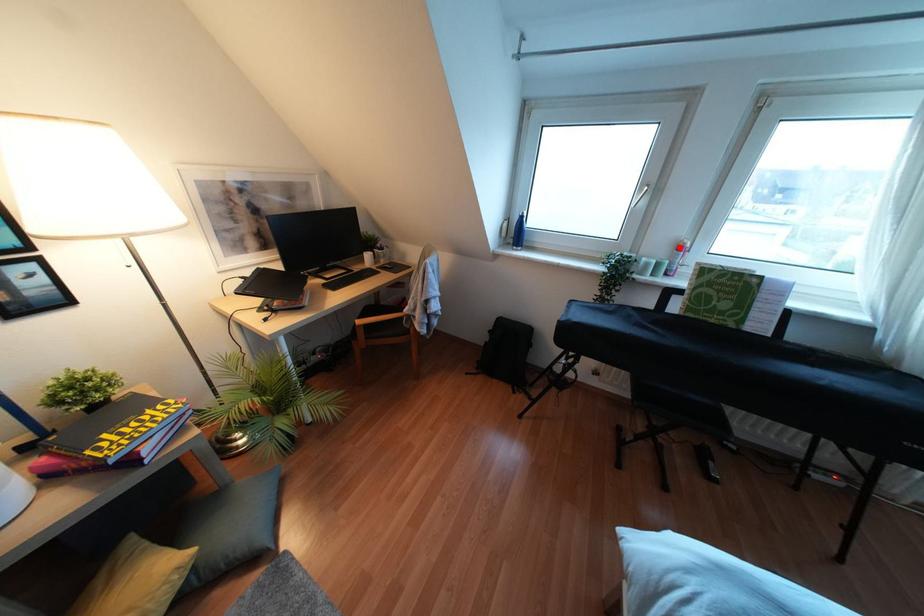
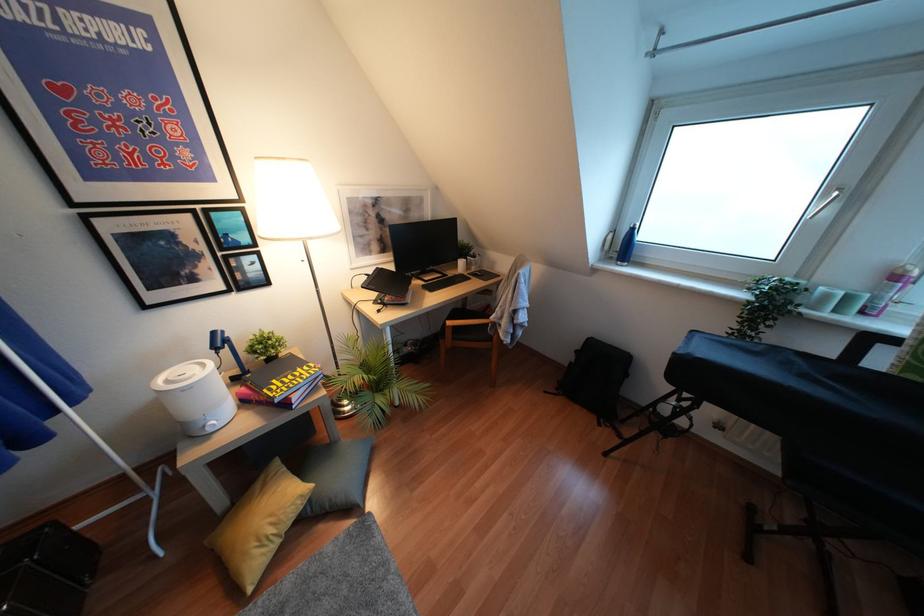
Question: I am providing you with two images of the same scene from different viewpoints. A red point is marked on the first image. Can you still see the location of the red point in image 2?

Choices:
 (A) Yes
 (B) No

Answer: (A)